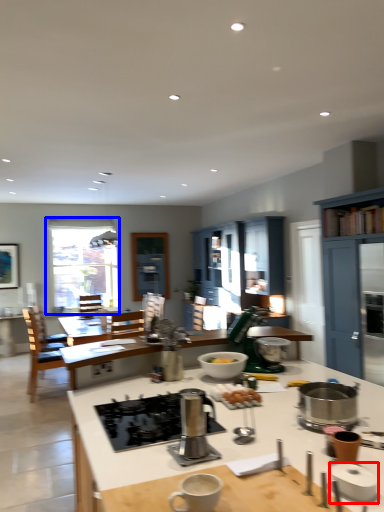
Question: Which object appears closest to the camera in this image, appliance (highlighted by a red box) or window (highlighted by a blue box)?

Choices:
 (A) appliance
 (B) window

Answer: (A)